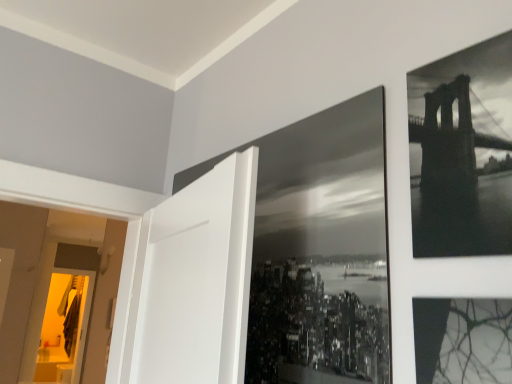
Question: Can you confirm if monochrome metallic bridge at upper right is smaller than black glossy photo frame at center?

Choices:
 (A) no
 (B) yes

Answer: (B)

Question: Considering the relative positions of monochrome metallic bridge at upper right and black glossy photo frame at center in the image provided, is monochrome metallic bridge at upper right behind black glossy photo frame at center?

Choices:
 (A) no
 (B) yes

Answer: (A)

Question: Is monochrome metallic bridge at upper right positioned with its back to black glossy photo frame at center?

Choices:
 (A) no
 (B) yes

Answer: (A)

Question: From a real-world perspective, is monochrome metallic bridge at upper right located higher than black glossy photo frame at center?

Choices:
 (A) no
 (B) yes

Answer: (B)

Question: Is there a large distance between monochrome metallic bridge at upper right and black glossy photo frame at center?

Choices:
 (A) yes
 (B) no

Answer: (B)

Question: Can you confirm if monochrome metallic bridge at upper right is shorter than black glossy photo frame at center?

Choices:
 (A) no
 (B) yes

Answer: (B)

Question: Is black glossy photo frame at center turned away from monochrome metallic bridge at upper right?

Choices:
 (A) yes
 (B) no

Answer: (B)

Question: Is the position of black glossy photo frame at center less distant than that of monochrome metallic bridge at upper right?

Choices:
 (A) yes
 (B) no

Answer: (B)

Question: From a real-world perspective, is black glossy photo frame at center positioned under monochrome metallic bridge at upper right based on gravity?

Choices:
 (A) yes
 (B) no

Answer: (A)

Question: From the image's perspective, is black glossy photo frame at center located above monochrome metallic bridge at upper right?

Choices:
 (A) no
 (B) yes

Answer: (A)

Question: Considering the relative sizes of black glossy photo frame at center and monochrome metallic bridge at upper right in the image provided, is black glossy photo frame at center thinner than monochrome metallic bridge at upper right?

Choices:
 (A) yes
 (B) no

Answer: (A)

Question: Is black glossy photo frame at center at the right side of monochrome metallic bridge at upper right?

Choices:
 (A) yes
 (B) no

Answer: (B)

Question: Considering the positions of point (436, 158) and point (348, 258), is point (436, 158) closer or farther from the camera than point (348, 258)?

Choices:
 (A) closer
 (B) farther

Answer: (A)